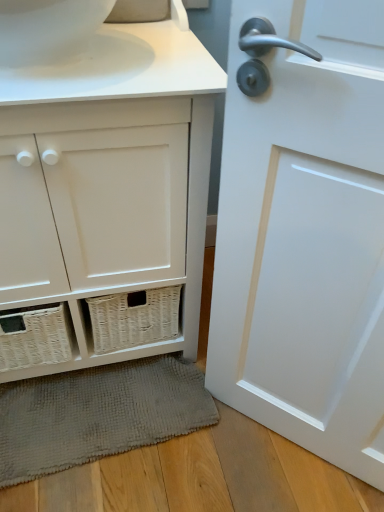
Question: In terms of size, does white glossy door at right appear bigger or smaller than gray textured bath mat at lower center?

Choices:
 (A) big
 (B) small

Answer: (A)

Question: Considering the positions of point (301, 370) and point (82, 397), is point (301, 370) closer or farther from the camera than point (82, 397)?

Choices:
 (A) closer
 (B) farther

Answer: (A)

Question: Which is nearer to the white glossy door at right?

Choices:
 (A) white wicker basket at lower left
 (B) gray textured bath mat at lower center
 (C) white glossy toilet bowl at upper left

Answer: (A)

Question: Estimate the real-world distances between objects in this image. Which object is farther from the white glossy toilet bowl at upper left?

Choices:
 (A) gray textured bath mat at lower center
 (B) white glossy door at right
 (C) white wicker basket at lower left

Answer: (A)